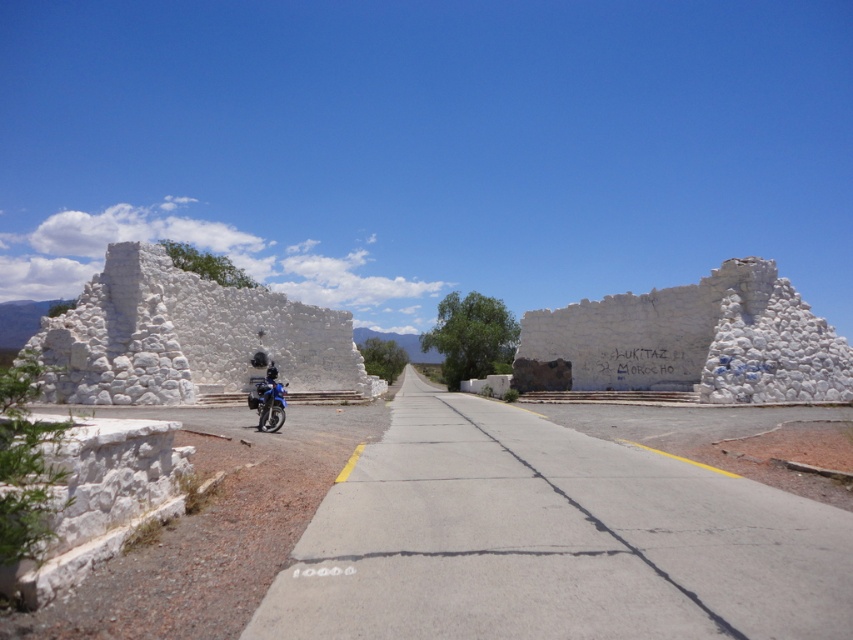
Does point (254, 294) come closer to viewer compared to point (259, 381)?

No, it is not.

Who is positioned more to the left, white stone ruins at left or blue metallic motorcycle at center?

From the viewer's perspective, white stone ruins at left appears more on the left side.

Between point (196, 316) and point (277, 419), which one is positioned behind?

The point (196, 316) is behind.

You are a GUI agent. You are given a task and a screenshot of the screen. Output one action in this format:
    pyautogui.click(x=<x>, y=<y>)
    Task: Click on the white stone ruins at left
    
    Given the screenshot: What is the action you would take?
    coord(187,337)

Does white stone ruins at left appear on the left side of white stone ruins at center?

Indeed, white stone ruins at left is positioned on the left side of white stone ruins at center.

In the scene shown: Can you confirm if white stone ruins at left is smaller than white stone ruins at center?

Incorrect, white stone ruins at left is not smaller in size than white stone ruins at center.

Measure the distance between point (170, 301) and camera.

Point (170, 301) is 22.84 meters from camera.

What are the coordinates of `white stone ruins at left` in the screenshot? It's located at 187,337.

Does point (674, 323) come in front of point (274, 428)?

No.

The width and height of the screenshot is (853, 640). Identify the location of white stone ruins at center. (689, 340).